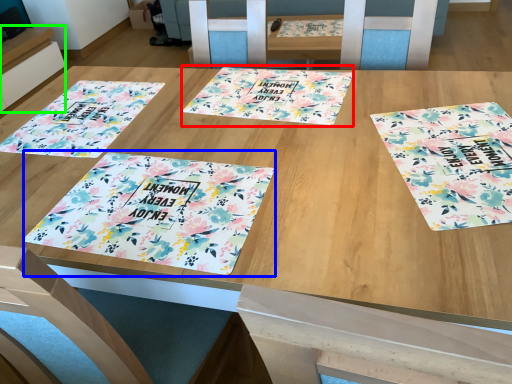
Question: Considering the real-world distances, which object is farthest from yoga mat (highlighted by a red box)? tablecloth (highlighted by a blue box) or table (highlighted by a green box)?

Choices:
 (A) tablecloth
 (B) table

Answer: (B)